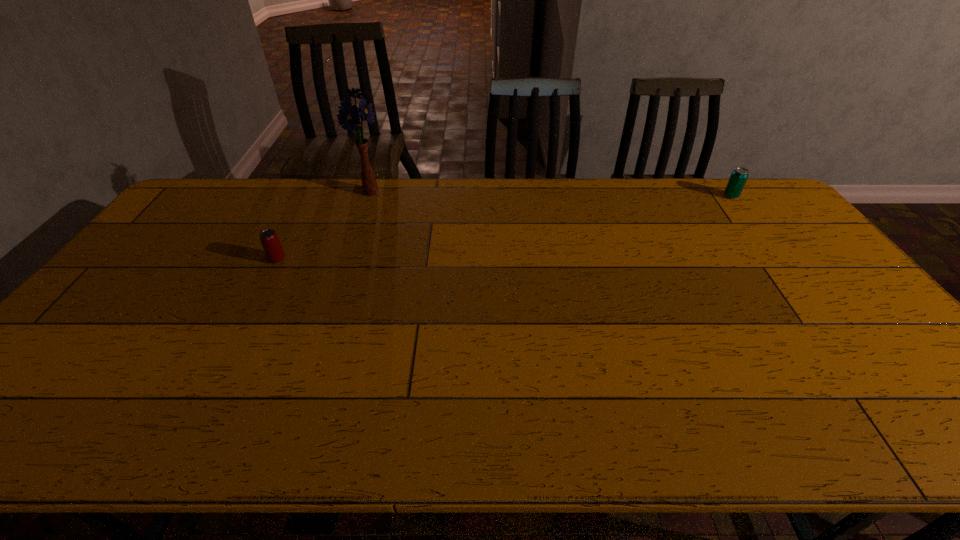
Where is `vacant area that lies between the nearest object and the tallest object`? This screenshot has height=540, width=960. vacant area that lies between the nearest object and the tallest object is located at coordinates (324, 225).

Where is `unoccupied area between the tallest object and the leftmost object`? The image size is (960, 540). unoccupied area between the tallest object and the leftmost object is located at coordinates (324, 225).

The width and height of the screenshot is (960, 540). I want to click on vacant region between the tallest object and the nearer beer can, so click(x=324, y=225).

This screenshot has height=540, width=960. I want to click on free space between the leftmost object and the right beer can, so click(x=504, y=227).

Where is `free spot between the leftmost object and the flower arrangement`? The height and width of the screenshot is (540, 960). free spot between the leftmost object and the flower arrangement is located at coordinates (324, 225).

Where is `vacant area that lies between the tallest object and the farther beer can`? The height and width of the screenshot is (540, 960). vacant area that lies between the tallest object and the farther beer can is located at coordinates (550, 194).

Find the location of a particular element. free space that is in between the second object from left to right and the farther beer can is located at coordinates (550, 194).

The width and height of the screenshot is (960, 540). In order to click on free space that is in between the tallest object and the nearest object in this screenshot , I will do `click(324, 225)`.

Identify which object is the nearest to the second object from left to right. Please provide its 2D coordinates. Your answer should be formatted as a tuple, i.e. [(x, y)], where the tuple contains the x and y coordinates of a point satisfying the conditions above.

[(269, 239)]

Identify which object is located as the second nearest to the right beer can. Please provide its 2D coordinates. Your answer should be formatted as a tuple, i.e. [(x, y)], where the tuple contains the x and y coordinates of a point satisfying the conditions above.

[(269, 239)]